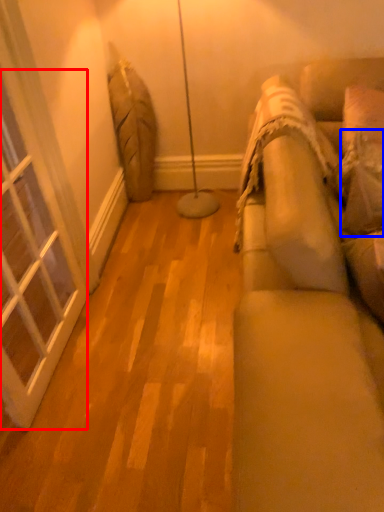
Question: Which object is further to the camera taking this photo, window (highlighted by a red box) or pillow (highlighted by a blue box)?

Choices:
 (A) window
 (B) pillow

Answer: (B)